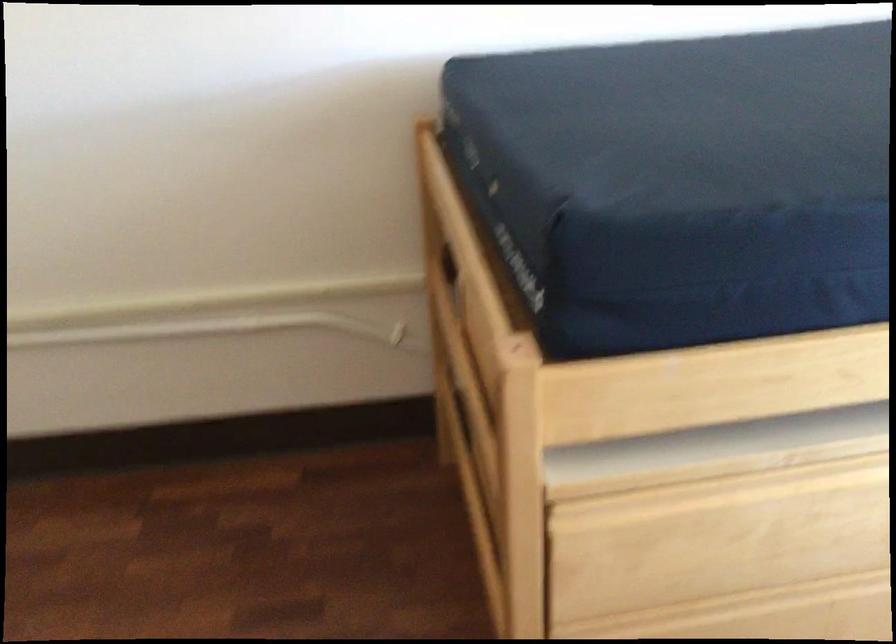
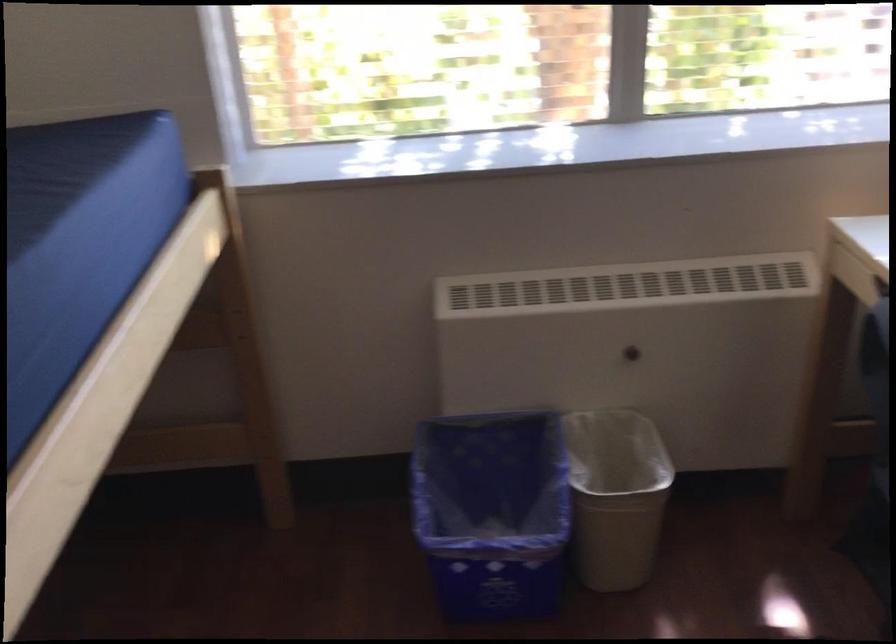
From the picture: The first image is from the beginning of the video and the second image is from the end. How did the camera likely rotate when shooting the video?

The camera rotated toward right-down.